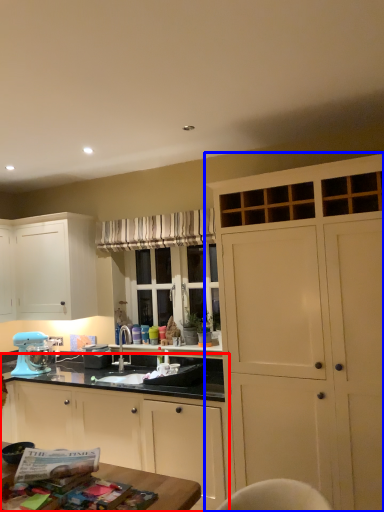
Question: Which object appears closest to the camera in this image, cabinetry (highlighted by a red box) or cabinetry (highlighted by a blue box)?

Choices:
 (A) cabinetry
 (B) cabinetry

Answer: (B)